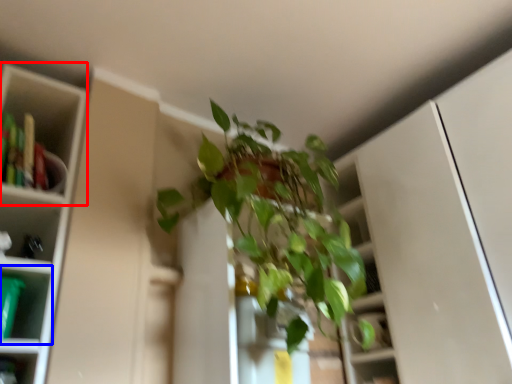
Question: Which object appears farthest to the camera in this image, cabinet (highlighted by a red box) or shelf (highlighted by a blue box)?

Choices:
 (A) cabinet
 (B) shelf

Answer: (A)